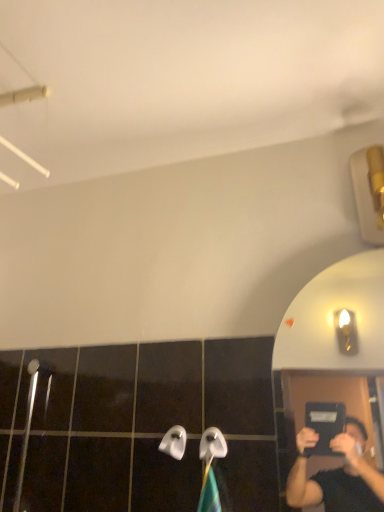
Question: Should I look upward or downward to see white plastic towel bar at center, which appears as the 1th towel bar when viewed from the right?

Choices:
 (A) up
 (B) down

Answer: (B)

Question: Does white plastic towel bar at center, the second towel bar viewed from the right, have a lesser height compared to white plastic towel bar at center, which appears as the 1th towel bar when viewed from the right?

Choices:
 (A) no
 (B) yes

Answer: (B)

Question: Does white plastic towel bar at center, the second towel bar viewed from the right, turn towards white plastic towel bar at center, which appears as the 1th towel bar when viewed from the right?

Choices:
 (A) yes
 (B) no

Answer: (B)

Question: Does white plastic towel bar at center, the second towel bar viewed from the right, have a lesser width compared to white plastic towel bar at center, which appears as the 1th towel bar when viewed from the right?

Choices:
 (A) no
 (B) yes

Answer: (B)

Question: Is white plastic towel bar at center, the second towel bar viewed from the right, facing away from white plastic towel bar at center, which appears as the 1th towel bar when viewed from the right?

Choices:
 (A) no
 (B) yes

Answer: (A)

Question: Could white plastic towel bar at center, which appears as the 1th towel bar when viewed from the right, be considered to be inside white plastic towel bar at center, acting as the 1th towel bar starting from the left?

Choices:
 (A) no
 (B) yes

Answer: (A)

Question: Does white plastic towel bar at center, acting as the 1th towel bar starting from the left, come in front of white plastic towel bar at center, which appears as the 1th towel bar when viewed from the right?

Choices:
 (A) no
 (B) yes

Answer: (A)

Question: Are white plastic towel bar at center, which appears as the 1th towel bar when viewed from the right, and white plastic towel bar at center, the second towel bar viewed from the right, making contact?

Choices:
 (A) no
 (B) yes

Answer: (B)

Question: Is white plastic towel bar at center, which appears as the 1th towel bar when viewed from the right, at the right side of white plastic towel bar at center, acting as the 1th towel bar starting from the left?

Choices:
 (A) yes
 (B) no

Answer: (A)

Question: From the image's perspective, is white plastic towel bar at center, which appears as the 1th towel bar when viewed from the right, below white plastic towel bar at center, the second towel bar viewed from the right?

Choices:
 (A) yes
 (B) no

Answer: (B)

Question: Considering the relative sizes of white plastic towel bar at center, which appears as the 1th towel bar when viewed from the right, and white plastic towel bar at center, the second towel bar viewed from the right, in the image provided, is white plastic towel bar at center, which appears as the 1th towel bar when viewed from the right, taller than white plastic towel bar at center, the second towel bar viewed from the right,?

Choices:
 (A) yes
 (B) no

Answer: (A)

Question: Is white plastic towel bar at center, which appears as the 2th towel bar when viewed from the left, facing towards white plastic towel bar at center, the second towel bar viewed from the right?

Choices:
 (A) yes
 (B) no

Answer: (B)

Question: Does white plastic towel bar at center, which appears as the 2th towel bar when viewed from the left, appear on the left side of white plastic towel bar at center, the second towel bar viewed from the right?

Choices:
 (A) no
 (B) yes

Answer: (A)

Question: From a real-world perspective, is white plastic towel bar at center, which appears as the 2th towel bar when viewed from the left, positioned above or below white plastic towel bar at center, the second towel bar viewed from the right?

Choices:
 (A) below
 (B) above

Answer: (A)